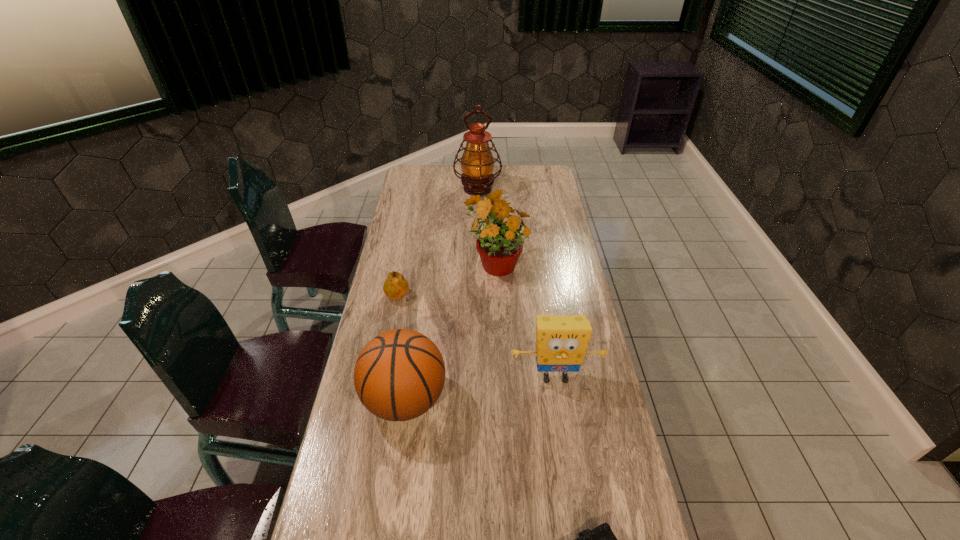
What are the coordinates of `unoccupied area between the flowerpot and the second shortest object` in the screenshot? It's located at (447, 280).

In order to click on free spot between the flowerpot and the pear in this screenshot , I will do point(447,280).

Locate an element on the screen. This screenshot has height=540, width=960. free space between the second shortest object and the farthest object is located at coordinates (438, 244).

Locate an element on the screen. the fourth closest object relative to the sponge is located at coordinates click(396, 286).

Select which object is the closest to the oil lamp. Please provide its 2D coordinates. Your answer should be formatted as a tuple, i.e. [(x, y)], where the tuple contains the x and y coordinates of a point satisfying the conditions above.

[(498, 244)]